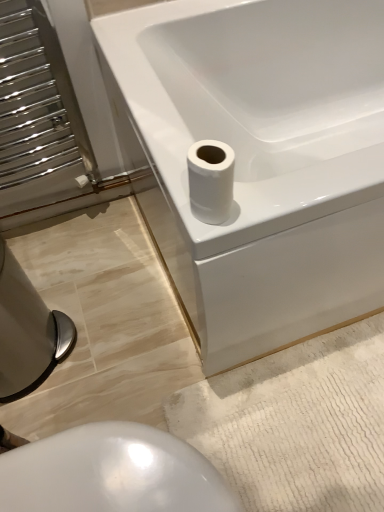
Question: Considering the relative sizes of white glossy bidet at lower center, which is counted as the 2th bidet, starting from the left, and white glossy bathtub at upper right in the image provided, is white glossy bidet at lower center, which is counted as the 2th bidet, starting from the left, thinner than white glossy bathtub at upper right?

Choices:
 (A) no
 (B) yes

Answer: (B)

Question: Does white glossy bidet at lower center, which is the first bidet from right to left, come in front of white glossy bathtub at upper right?

Choices:
 (A) no
 (B) yes

Answer: (B)

Question: Is white glossy bidet at lower center, which is counted as the 2th bidet, starting from the left, facing towards white glossy bathtub at upper right?

Choices:
 (A) no
 (B) yes

Answer: (A)

Question: Does white glossy bidet at lower center, which is counted as the 2th bidet, starting from the left, have a greater width compared to white glossy bathtub at upper right?

Choices:
 (A) yes
 (B) no

Answer: (B)

Question: Can you confirm if white glossy bidet at lower center, which is counted as the 2th bidet, starting from the left, is shorter than white glossy bathtub at upper right?

Choices:
 (A) no
 (B) yes

Answer: (B)

Question: From the image's perspective, does white glossy bidet at lower center, which is counted as the 2th bidet, starting from the left, appear lower than white glossy bathtub at upper right?

Choices:
 (A) yes
 (B) no

Answer: (A)

Question: Is white glossy bathtub at upper right behind white glossy toilet paper at upper right?

Choices:
 (A) yes
 (B) no

Answer: (A)

Question: Is white glossy bathtub at upper right looking in the opposite direction of white glossy toilet paper at upper right?

Choices:
 (A) no
 (B) yes

Answer: (A)

Question: Are white glossy bathtub at upper right and white glossy toilet paper at upper right located far from each other?

Choices:
 (A) yes
 (B) no

Answer: (B)

Question: From a real-world perspective, is white glossy bathtub at upper right physically below white glossy toilet paper at upper right?

Choices:
 (A) yes
 (B) no

Answer: (A)

Question: Is the position of white glossy bathtub at upper right less distant than that of white glossy toilet paper at upper right?

Choices:
 (A) no
 (B) yes

Answer: (A)

Question: Could you tell me if white glossy bathtub at upper right is facing white glossy toilet paper at upper right?

Choices:
 (A) yes
 (B) no

Answer: (B)

Question: Considering the relative sizes of white glossy bidet at lower center, which is the first bidet from right to left, and white glossy toilet paper at upper right in the image provided, is white glossy bidet at lower center, which is the first bidet from right to left, wider than white glossy toilet paper at upper right?

Choices:
 (A) no
 (B) yes

Answer: (B)